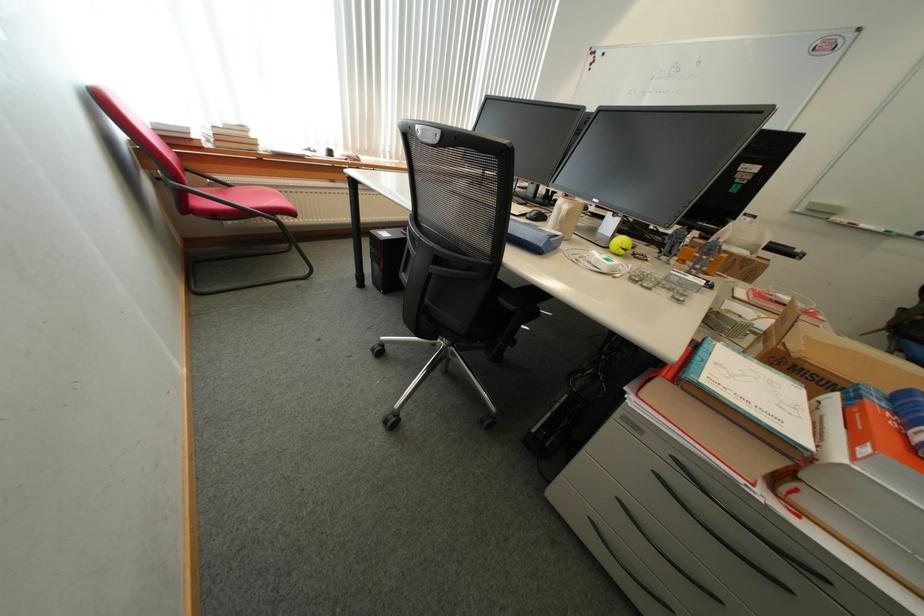
Image resolution: width=924 pixels, height=616 pixels. Identify the location of black office chair sitting surface. (480, 306).